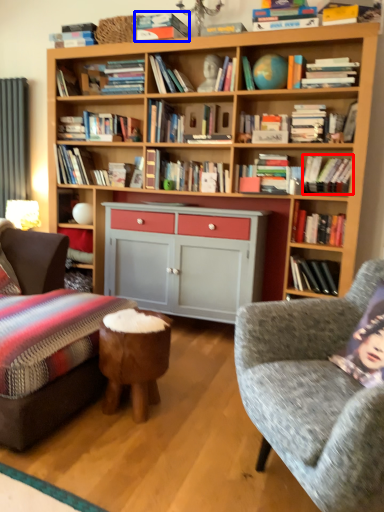
Question: Which point is closer to the camera, book (highlighted by a red box) or book (highlighted by a blue box)?

Choices:
 (A) book
 (B) book

Answer: (A)